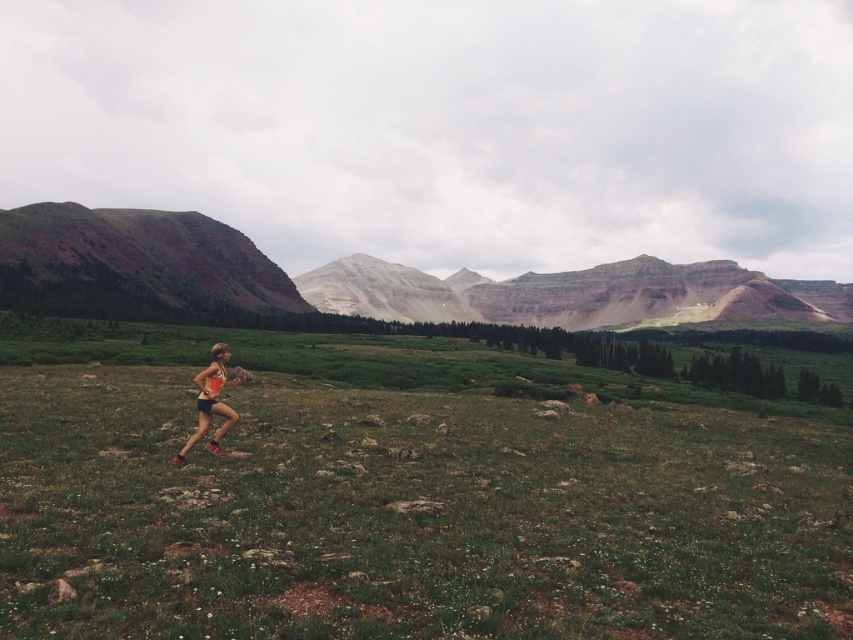
Which of these two, rustic brown cliff at left or rustic rock hillside at left, stands shorter?

With less height is rustic rock hillside at left.

Which is more to the right, rustic brown cliff at left or rustic rock hillside at left?

rustic brown cliff at left

Measure the distance between rustic brown cliff at left and camera.

They are 250.13 meters apart.

You are a GUI agent. You are given a task and a screenshot of the screen. Output one action in this format:
    pyautogui.click(x=<x>, y=<y>)
    Task: Click on the rustic brown cliff at left
    This screenshot has width=853, height=640.
    Given the screenshot: What is the action you would take?
    pyautogui.click(x=358, y=280)

Is green grassy field at center in front of rustic rock hillside at left?

That is True.

Consider the image. Is green grassy field at center thinner than rustic rock hillside at left?

No.

Which is behind, point (344, 490) or point (225, 296)?

Point (225, 296)

At what (x,y) coordinates should I click in order to perform the action: click on green grassy field at center. Please return your answer as a coordinate pair (x, y). The height and width of the screenshot is (640, 853). Looking at the image, I should click on (405, 493).

Can you confirm if rustic rock hillside at left is smaller than orange fabric running suit at center?

No.

Between point (158, 212) and point (210, 410), which one is positioned behind?

Point (158, 212)

The height and width of the screenshot is (640, 853). I want to click on rustic rock hillside at left, so click(136, 260).